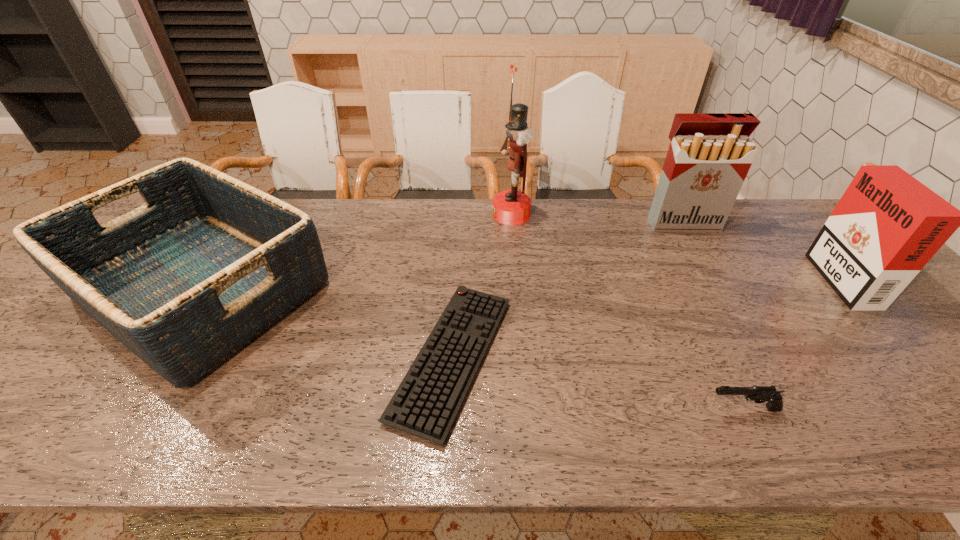
I want to click on object at the right edge, so click(886, 227).

At what (x,y) coordinates should I click in order to perform the action: click on object at the far right corner. Please return your answer as a coordinate pair (x, y). Looking at the image, I should click on (886, 227).

The width and height of the screenshot is (960, 540). I want to click on blank space at the far edge, so click(766, 245).

Identify the location of free point at the near edge. (580, 421).

Image resolution: width=960 pixels, height=540 pixels. In the image, there is a desktop. In order to click on vacant space at the left edge in this screenshot , I will do `click(45, 386)`.

This screenshot has height=540, width=960. Identify the location of vacant area at the right edge of the desktop. (872, 327).

You are a GUI agent. You are given a task and a screenshot of the screen. Output one action in this format:
    pyautogui.click(x=<x>, y=<y>)
    Task: Click on the vacant space at the far right corner
    The height and width of the screenshot is (540, 960).
    Given the screenshot: What is the action you would take?
    pyautogui.click(x=771, y=213)

Identify the location of vacant area that lies between the shorter cigarette case and the shortest object. Image resolution: width=960 pixels, height=540 pixels. (644, 316).

Identify the location of empty space between the shortest object and the gun. This screenshot has width=960, height=540. (597, 383).

Where is `free point between the nutcracker and the computer keyboard`? Image resolution: width=960 pixels, height=540 pixels. free point between the nutcracker and the computer keyboard is located at coordinates click(x=482, y=286).